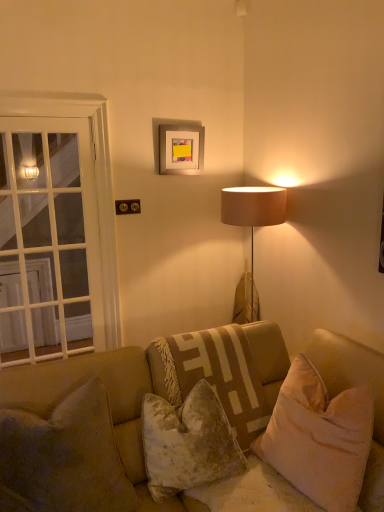
At what (x,y) coordinates should I click in order to perform the action: click on free space above white glass door at left (from a real-world perspective). Please return your answer as a coordinate pair (x, y). Looking at the image, I should click on (38, 117).